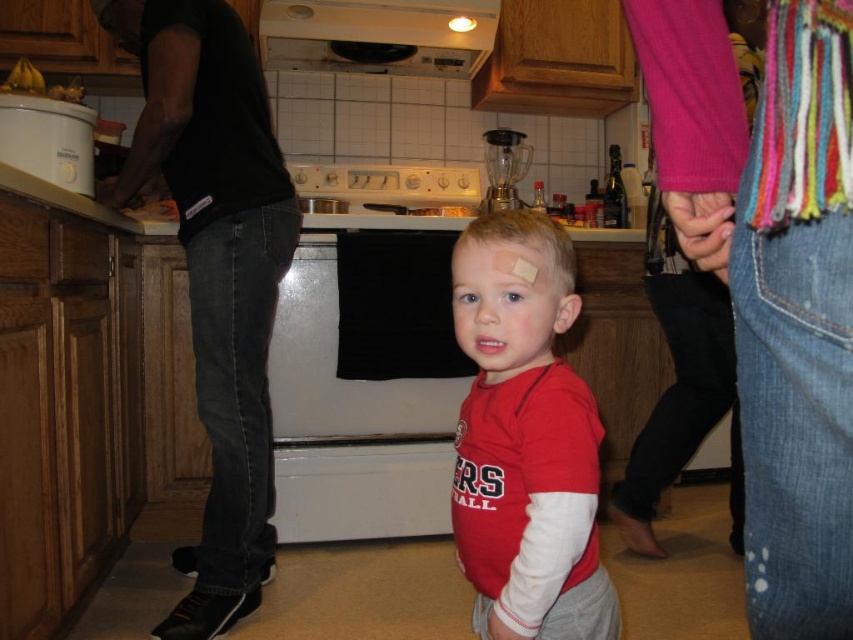
You are a kitchen designer planning to install a new appliance between the white glossy oven at center and the white matte exhaust hood at upper center. Based on their positions, which appliance should be placed to the left of the other?

The white glossy oven at center is to the right of the white matte exhaust hood at upper center, so the new appliance should be placed to the left of the white glossy oven at center and to the right of the white matte exhaust hood at upper center to maintain the existing order.

Based on the photo, you are a home inspector assessing the kitchen layout. You notice the white matte exhaust hood at upper center and the white glossy stove at center. According to safety standards, the exhaust hood must be positioned directly above the stove. Does the current arrangement comply with this requirement?

The white matte exhaust hood at upper center is in front of the white glossy stove at center, meaning it is positioned directly above the stove. Therefore, the current arrangement complies with safety standards.

In the kitchen scene, there is a white glossy oven at center and a white glossy stove at center. Which one is positioned lower in the image?

The white glossy oven at center is positioned below the white glossy stove at center, so it is lower in the image.